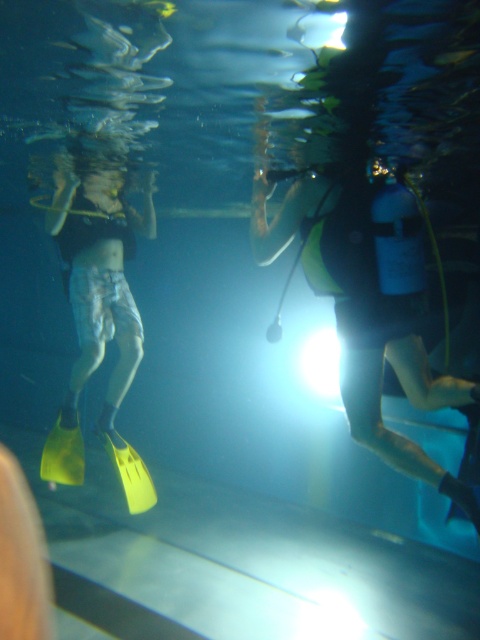
Does yellow matte scuba gear at center lie behind yellow matte paddle at lower center?

No, yellow matte scuba gear at center is closer to the viewer.

Who is lower down, yellow matte scuba gear at center or yellow matte paddle at lower center?

yellow matte paddle at lower center

Find the location of a particular element. The image size is (480, 640). yellow matte scuba gear at center is located at coordinates (361, 317).

Locate an element on the screen. yellow matte scuba gear at center is located at coordinates (361, 317).

Can you confirm if yellow matte scuba gear at center is smaller than yellow rubber fins at left?

Yes, yellow matte scuba gear at center is smaller than yellow rubber fins at left.

Between yellow matte scuba gear at center and yellow rubber fins at left, which one appears on the right side from the viewer's perspective?

yellow matte scuba gear at center

This screenshot has width=480, height=640. What do you see at coordinates (361, 317) in the screenshot? I see `yellow matte scuba gear at center` at bounding box center [361, 317].

Find the location of a particular element. This screenshot has width=480, height=640. yellow matte scuba gear at center is located at coordinates (361, 317).

Between yellow rubber fins at left and yellow matte paddle at lower center, which one is positioned lower?

yellow matte paddle at lower center is below.

Image resolution: width=480 pixels, height=640 pixels. In order to click on yellow rubber fins at left in this screenshot , I will do [x=96, y=317].

Is point (100, 257) closer to viewer compared to point (132, 481)?

Yes, point (100, 257) is closer to viewer.

What are the coordinates of `yellow rubber fins at left` in the screenshot? It's located at (96, 317).